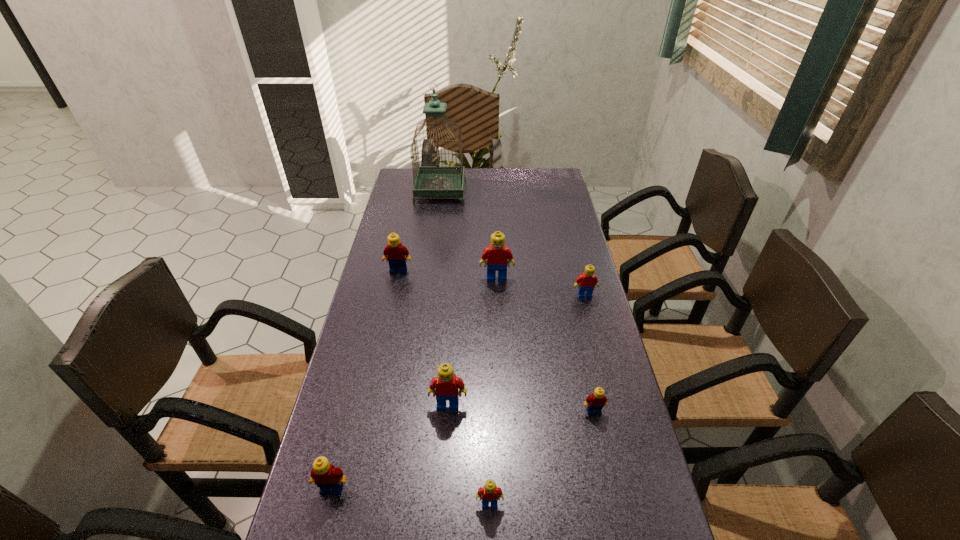
Where is `free point between the biggest yellow Lego and the biggest red Lego`? This screenshot has width=960, height=540. free point between the biggest yellow Lego and the biggest red Lego is located at coordinates (447, 274).

The height and width of the screenshot is (540, 960). What are the coordinates of `blank region between the rightmost yellow Lego and the nearest Lego` in the screenshot? It's located at pos(541,457).

In order to click on free space between the fourth farthest object and the birdcage in this screenshot , I will do `click(513, 243)`.

Identify the location of unoccupied area between the tallest Lego and the biggest yellow Lego. (447, 274).

Where is `empty location between the smallest red Lego and the farthest object`? empty location between the smallest red Lego and the farthest object is located at coordinates (465, 347).

The height and width of the screenshot is (540, 960). Identify the location of free spot between the smallest yellow Lego and the biggest yellow Lego. (496, 341).

The image size is (960, 540). I want to click on vacant point located between the biggest yellow Lego and the farthest red Lego, so click(x=447, y=274).

The height and width of the screenshot is (540, 960). What are the coordinates of `free space that is in between the rightmost yellow Lego and the tallest object` in the screenshot? It's located at (517, 301).

I want to click on free space between the third nearest red Lego and the third smallest red Lego, so click(x=516, y=350).

Where is `object that stands as the third closest to the second nearest Lego`? This screenshot has width=960, height=540. object that stands as the third closest to the second nearest Lego is located at coordinates (595, 402).